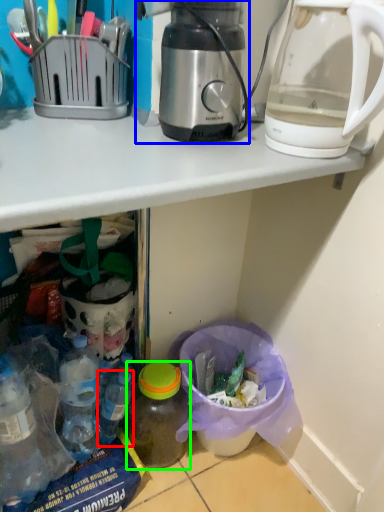
Question: Which object is positioned closest to bottle (highlighted by a red box)? Select from coffee maker (highlighted by a blue box) and bottle (highlighted by a green box).

Choices:
 (A) coffee maker
 (B) bottle

Answer: (B)